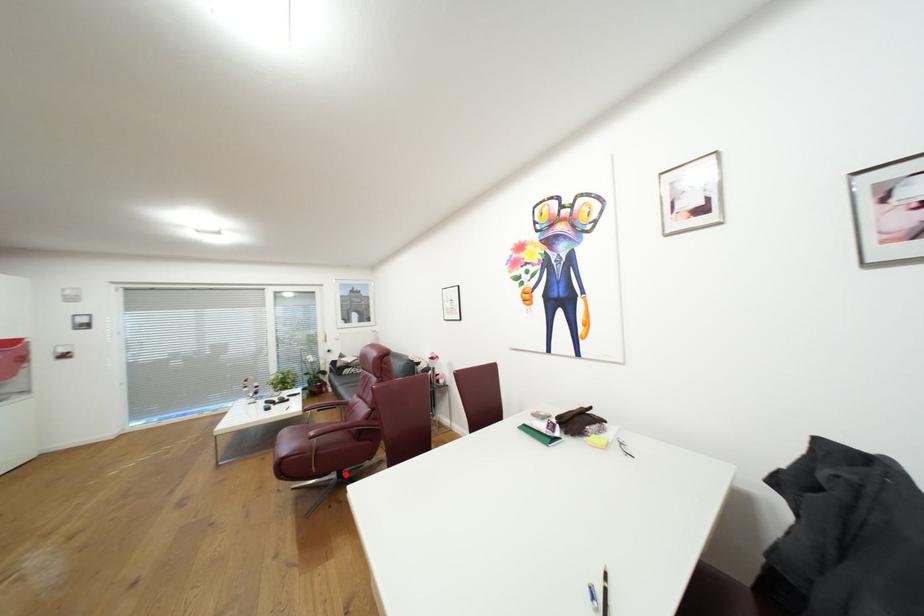
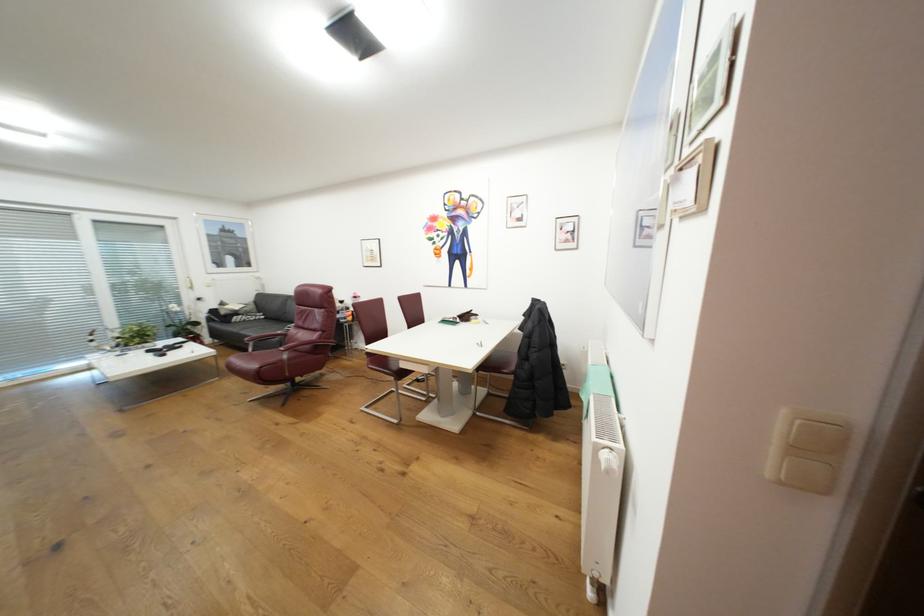
Find the pixel in the second image that matches the highlighted location in the first image.

(300, 384)